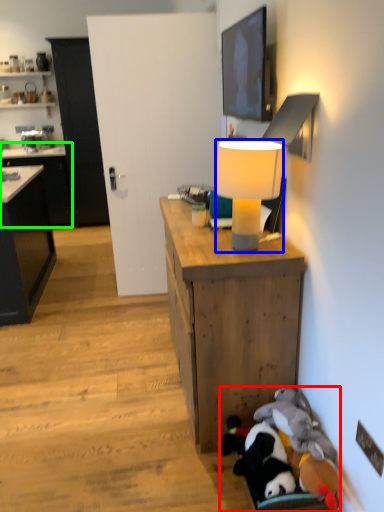
Question: Which object is the farthest from stuff (highlighted by a red box)? Choose among these: lamp (highlighted by a blue box) or cabinetry (highlighted by a green box).

Choices:
 (A) lamp
 (B) cabinetry

Answer: (B)